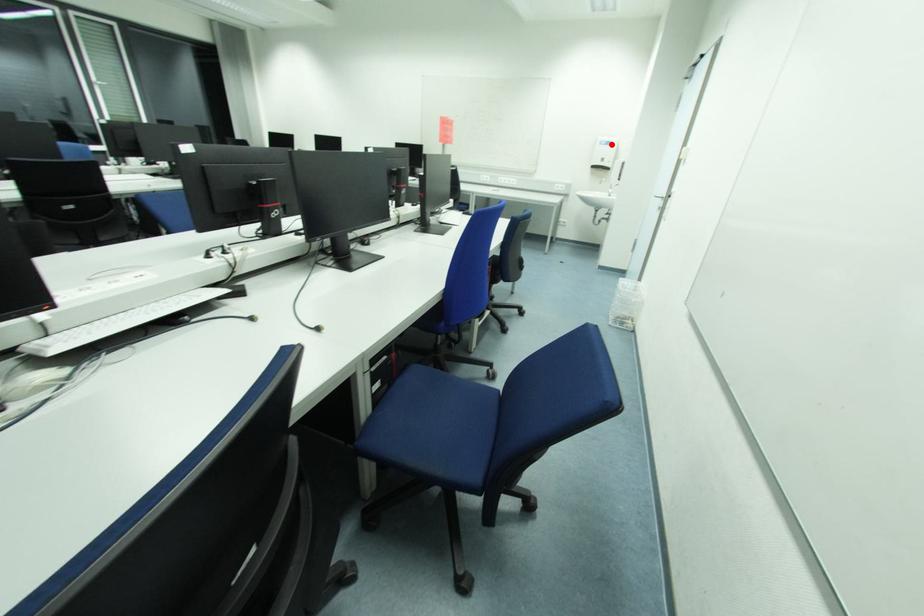
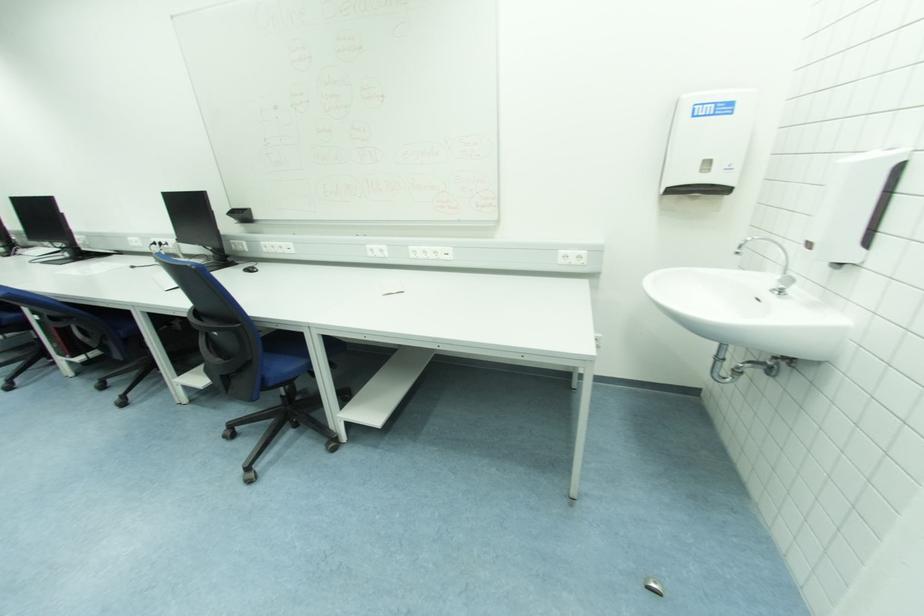
The point at the highlighted location is marked in the first image. Where is the corresponding point in the second image?

(731, 110)